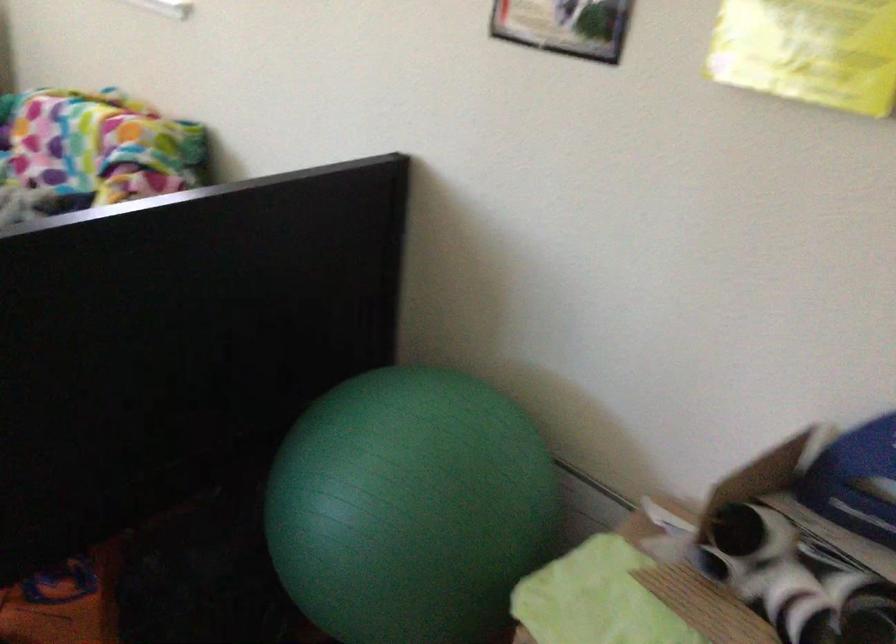
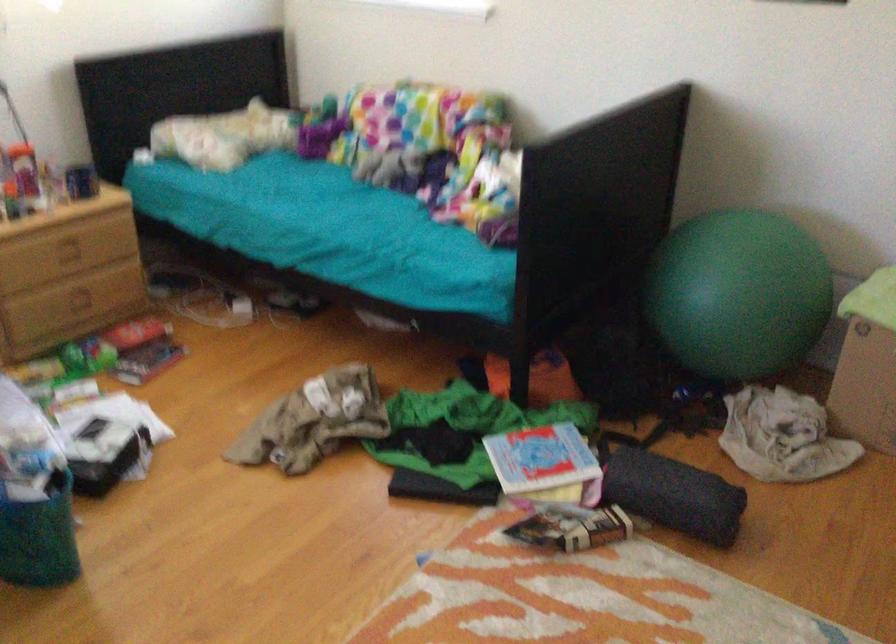
The images are taken continuously from a first-person perspective. In which direction are you moving?

The cameraman moved toward left, backward.